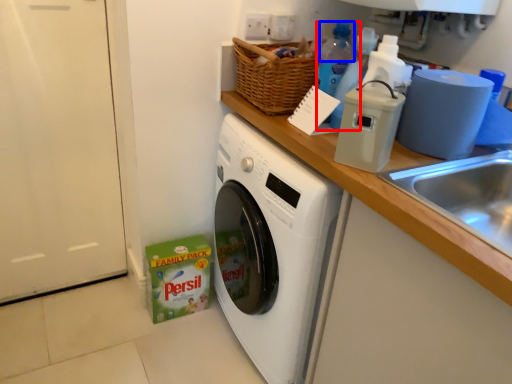
Question: Among these objects, which one is farthest to the camera, bottle (highlighted by a red box) or bottle (highlighted by a blue box)?

Choices:
 (A) bottle
 (B) bottle

Answer: (B)